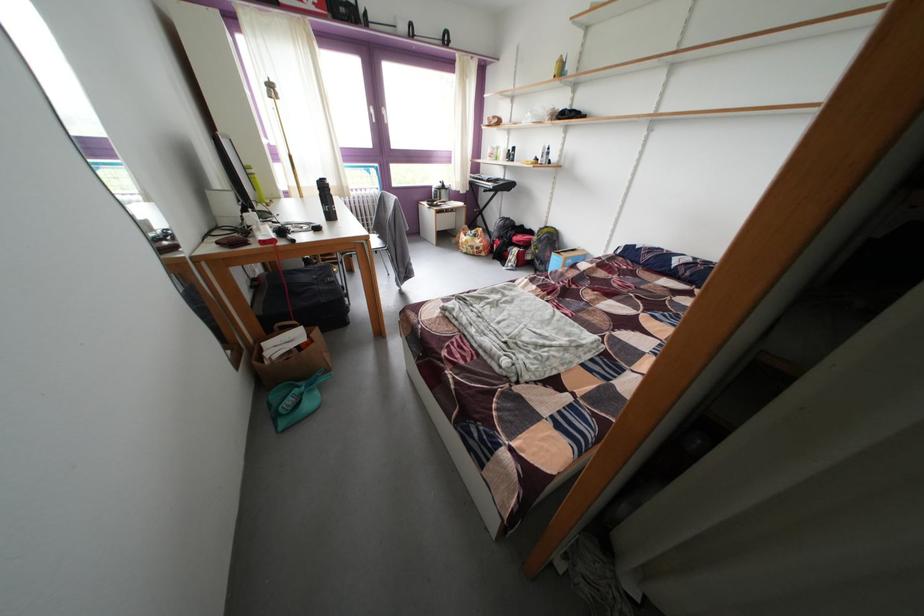
Where is `turquoise brush handle`? Image resolution: width=924 pixels, height=616 pixels. turquoise brush handle is located at coordinates (258, 188).